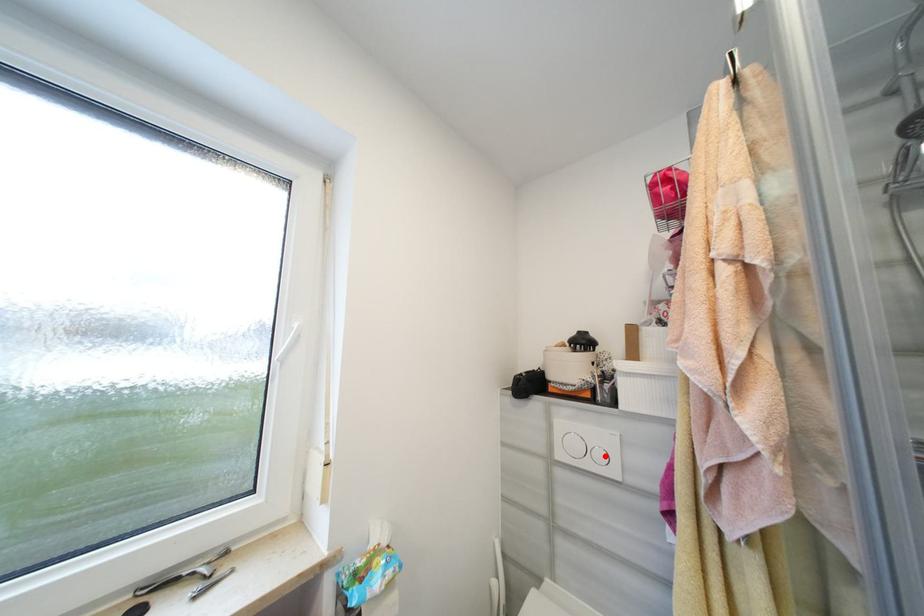
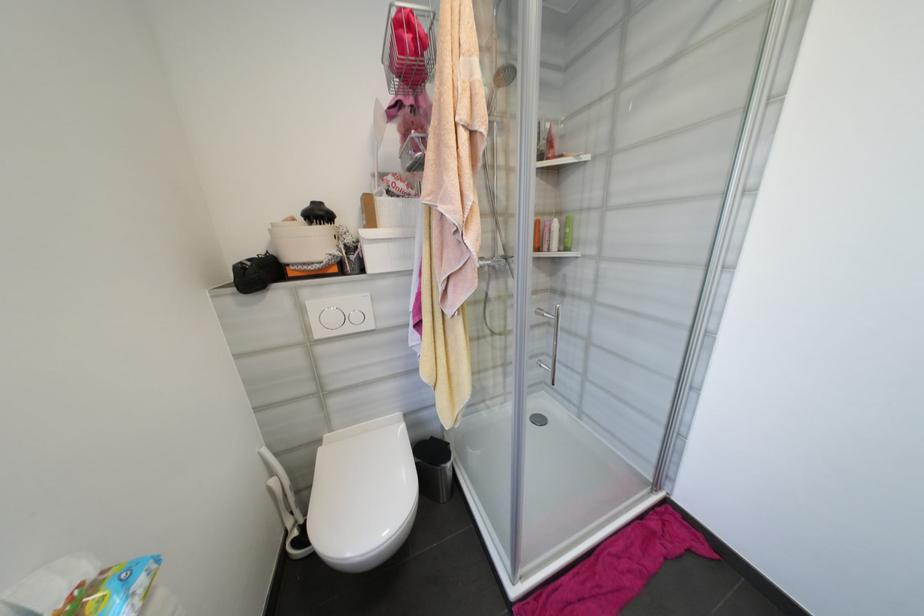
Question: I am providing you with two images of the same scene from different viewpoints. In image1, a red point is highlighted. Considering the same 3D point in image2, which of the following is correct?

Choices:
 (A) It is closer
 (B) It is farther

Answer: (A)